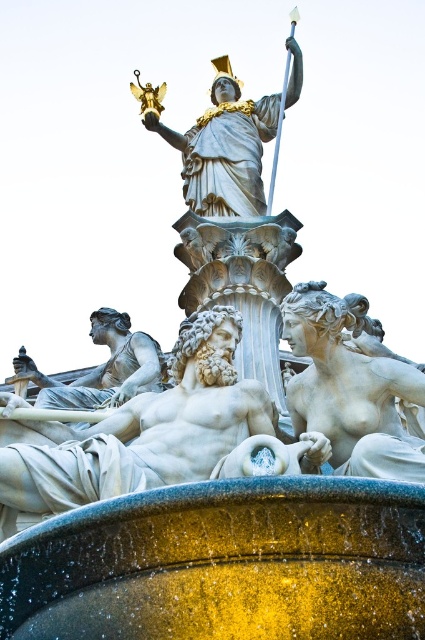
Which is in front, point (155, 483) or point (130, 332)?

Point (155, 483)

Between white marble statue at center and white marble statue at lower left, which one is positioned higher?

Positioned higher is white marble statue at lower left.

Does point (96, 465) lie in front of point (81, 387)?

Yes, point (96, 465) is in front of point (81, 387).

Locate an element on the screen. white marble statue at center is located at coordinates (153, 435).

Does polished bronze statue at center have a lesser height compared to white marble statue at lower left?

Incorrect, polished bronze statue at center's height does not fall short of white marble statue at lower left's.

Does polished bronze statue at center have a lesser width compared to white marble statue at lower left?

No, polished bronze statue at center is not thinner than white marble statue at lower left.

Locate an element on the screen. polished bronze statue at center is located at coordinates (223, 148).

Who is shorter, white marble statue at center or polished bronze statue at center?

white marble statue at center is shorter.

In the scene shown: Is white marble statue at center bigger than polished bronze statue at center?

No, white marble statue at center is not bigger than polished bronze statue at center.

Does point (159, 460) lie behind point (226, 61)?

That is False.

Where is `white marble statue at center`? white marble statue at center is located at coordinates (153, 435).